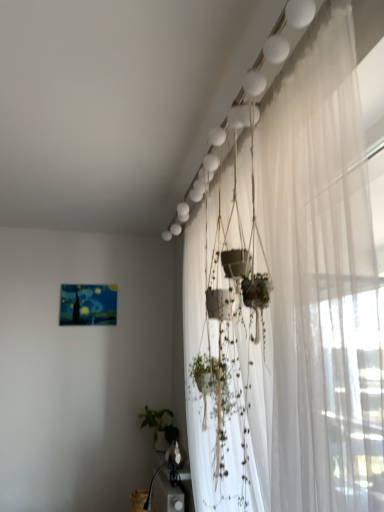
In the scene shown: In order to face green matte plant at lower center, should I rotate leftwards or rightwards?

Turn left approximately 4.698 degrees to face it.

What do you see at coordinates (159, 424) in the screenshot? The width and height of the screenshot is (384, 512). I see `green matte plant at lower center` at bounding box center [159, 424].

Image resolution: width=384 pixels, height=512 pixels. What are the coordinates of `green matte plant at lower center` in the screenshot? It's located at (159, 424).

Locate an element on the screen. Image resolution: width=384 pixels, height=512 pixels. white sheer curtain at upper right is located at coordinates (299, 301).

This screenshot has height=512, width=384. What do you see at coordinates (299, 301) in the screenshot? I see `white sheer curtain at upper right` at bounding box center [299, 301].

The height and width of the screenshot is (512, 384). I want to click on green matte plant at lower center, so click(x=159, y=424).

Which is more to the right, white sheer curtain at upper right or green matte plant at lower center?

white sheer curtain at upper right is more to the right.

Which object is closer to the camera, white sheer curtain at upper right or green matte plant at lower center?

white sheer curtain at upper right is in front.

Is point (285, 80) positioned after point (168, 429)?

No, it is in front of (168, 429).

From the image's perspective, between white sheer curtain at upper right and green matte plant at lower center, which one is located above?

white sheer curtain at upper right.

From a real-world perspective, which is physically above, white sheer curtain at upper right or green matte plant at lower center?

white sheer curtain at upper right is physically above.

Does white sheer curtain at upper right have a lesser width compared to green matte plant at lower center?

Incorrect, the width of white sheer curtain at upper right is not less than that of green matte plant at lower center.

Between white sheer curtain at upper right and green matte plant at lower center, which one has more height?

white sheer curtain at upper right.

Considering the sizes of objects white sheer curtain at upper right and green matte plant at lower center in the image provided, who is smaller, white sheer curtain at upper right or green matte plant at lower center?

Smaller between the two is green matte plant at lower center.

Is white sheer curtain at upper right completely or partially outside of green matte plant at lower center?

white sheer curtain at upper right is positioned outside green matte plant at lower center.

Is white sheer curtain at upper right not near green matte plant at lower center?

Yes, white sheer curtain at upper right and green matte plant at lower center are quite far apart.

Is white sheer curtain at upper right looking in the opposite direction of green matte plant at lower center?

No, white sheer curtain at upper right's orientation is not away from green matte plant at lower center.

How distant is white sheer curtain at upper right from green matte plant at lower center?

5.83 feet.

You are a GUI agent. You are given a task and a screenshot of the screen. Output one action in this format:
    pyautogui.click(x=<x>, y=<y>)
    Task: Click on the plant directly beneath the white sheer curtain at upper right (from a real-world perspective)
    The width and height of the screenshot is (384, 512).
    Given the screenshot: What is the action you would take?
    click(159, 424)

Is green matte plant at lower center at the right side of white sheer curtain at upper right?

No, green matte plant at lower center is not to the right of white sheer curtain at upper right.

Is the depth of green matte plant at lower center greater than that of white sheer curtain at upper right?

Yes, green matte plant at lower center is further from the camera.

Does point (155, 441) come in front of point (350, 199)?

No.

From the image's perspective, which one is positioned lower, green matte plant at lower center or white sheer curtain at upper right?

green matte plant at lower center is shown below in the image.

From a real-world perspective, is green matte plant at lower center on white sheer curtain at upper right?

No, from a real-world perspective, green matte plant at lower center is not above white sheer curtain at upper right.

Consider the image. Between green matte plant at lower center and white sheer curtain at upper right, which one has larger width?

white sheer curtain at upper right is wider.

From their relative heights in the image, would you say green matte plant at lower center is taller or shorter than white sheer curtain at upper right?

green matte plant at lower center is shorter than white sheer curtain at upper right.

Between green matte plant at lower center and white sheer curtain at upper right, which one has larger size?

Bigger between the two is white sheer curtain at upper right.

Is green matte plant at lower center positioned beyond the bounds of white sheer curtain at upper right?

green matte plant at lower center is positioned outside white sheer curtain at upper right.

Are green matte plant at lower center and white sheer curtain at upper right located far from each other?

Yes, green matte plant at lower center and white sheer curtain at upper right are quite far apart.

Is green matte plant at lower center facing towards white sheer curtain at upper right?

No, green matte plant at lower center is not aimed at white sheer curtain at upper right.

How distant is green matte plant at lower center from white sheer curtain at upper right?

green matte plant at lower center and white sheer curtain at upper right are 5.83 feet apart.

The height and width of the screenshot is (512, 384). What are the coordinates of `plant located underneath the white sheer curtain at upper right (from a real-world perspective)` in the screenshot? It's located at (159, 424).

The image size is (384, 512). What are the coordinates of `curtain above the green matte plant at lower center (from a real-world perspective)` in the screenshot? It's located at (299, 301).

Locate an element on the screen. This screenshot has width=384, height=512. curtain located in front of the green matte plant at lower center is located at coordinates (299, 301).